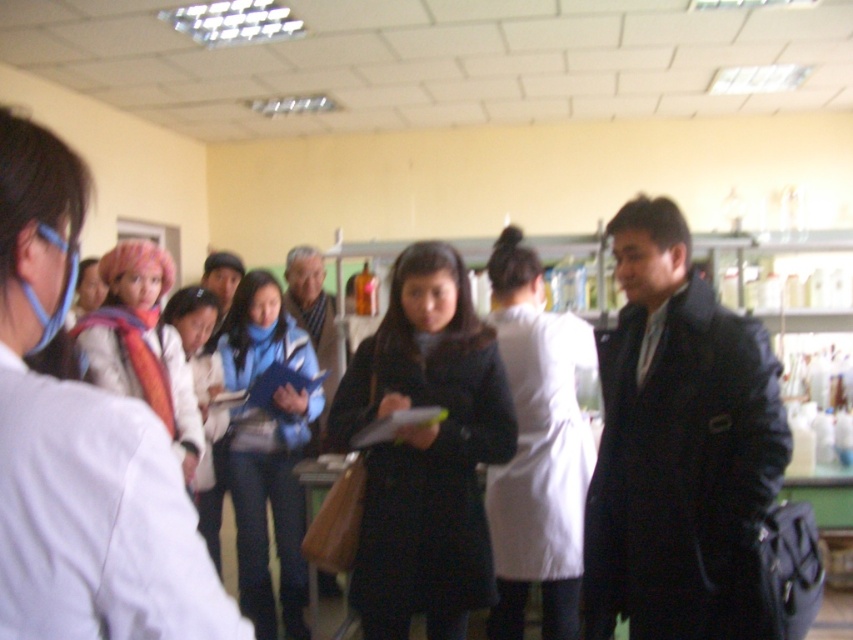
Is point (253, 508) closer to camera compared to point (198, 454)?

No, it is not.

Is blue fleece jacket at center closer to the viewer compared to matte pink scarf at center?

No, blue fleece jacket at center is further to the viewer.

This screenshot has height=640, width=853. What are the coordinates of `blue fleece jacket at center` in the screenshot? It's located at (270, 504).

This screenshot has width=853, height=640. In order to click on blue fleece jacket at center in this screenshot , I will do `click(270, 504)`.

Can you confirm if black matte coat at center is positioned above blue fleece jacket at center?

Yes.

Is black matte coat at center to the right of blue fleece jacket at center from the viewer's perspective?

Indeed, black matte coat at center is positioned on the right side of blue fleece jacket at center.

Locate an element on the screen. The image size is (853, 640). black matte coat at center is located at coordinates (425, 451).

Find the location of a particular element. The width and height of the screenshot is (853, 640). black matte coat at center is located at coordinates (425, 451).

What do you see at coordinates (425, 451) in the screenshot?
I see `black matte coat at center` at bounding box center [425, 451].

Locate an element on the screen. The width and height of the screenshot is (853, 640). black matte coat at center is located at coordinates pos(425,451).

Is point (386, 509) closer to viewer compared to point (135, 257)?

That is True.

Identify the location of black matte coat at center. This screenshot has height=640, width=853. (425, 451).